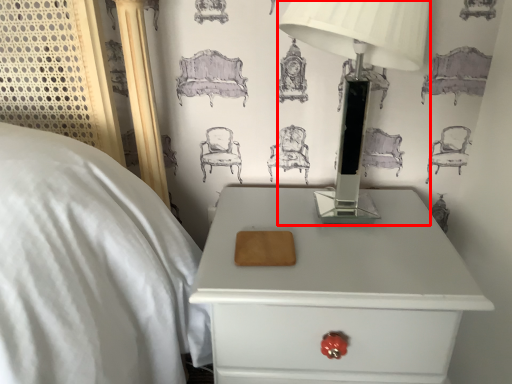
Question: From the image's perspective, considering the relative positions of table lamp (annotated by the red box) and nightstand in the image provided, where is table lamp (annotated by the red box) located with respect to the staircase?

Choices:
 (A) above
 (B) below

Answer: (A)